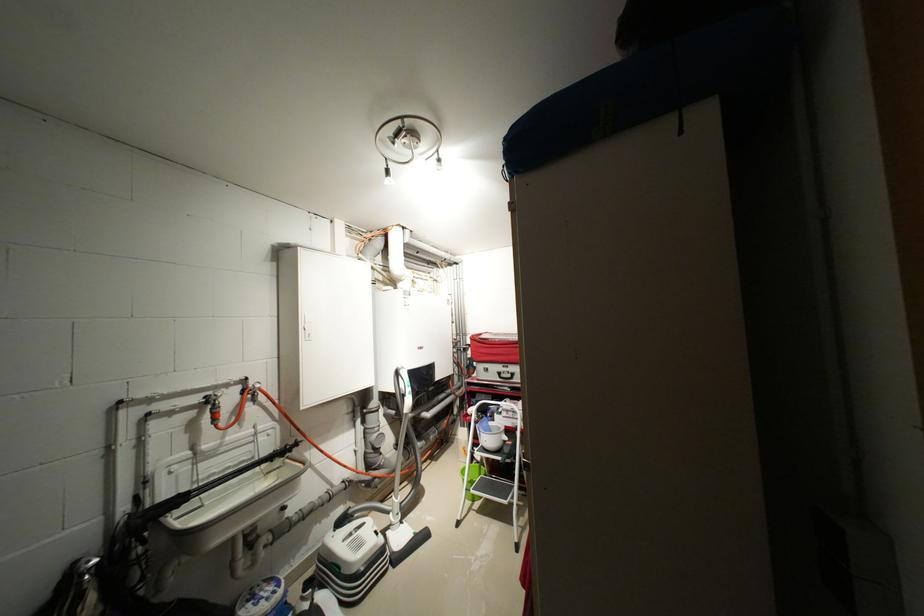
Find where to turn the red spigot handle. Please return your answer as a coordinate pair (x, y).

(214, 408)